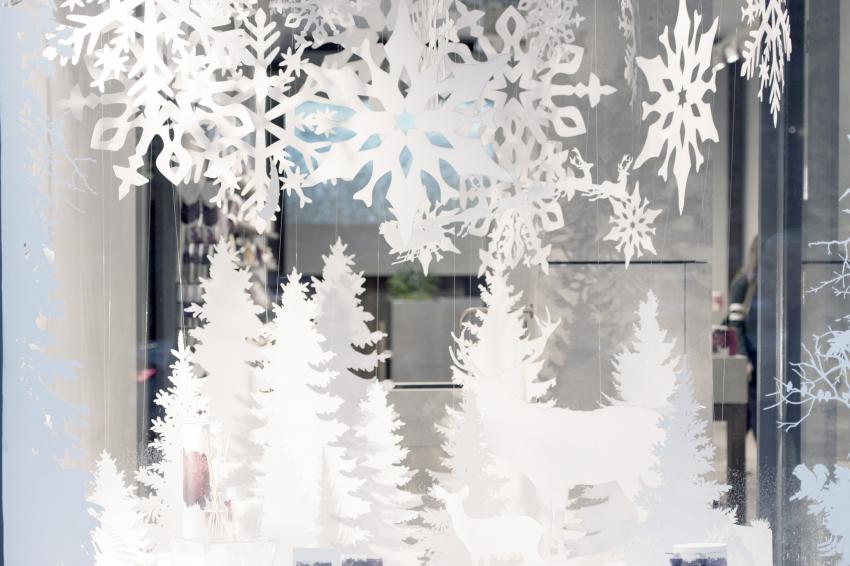
I want to click on projector screen, so click(337, 228).